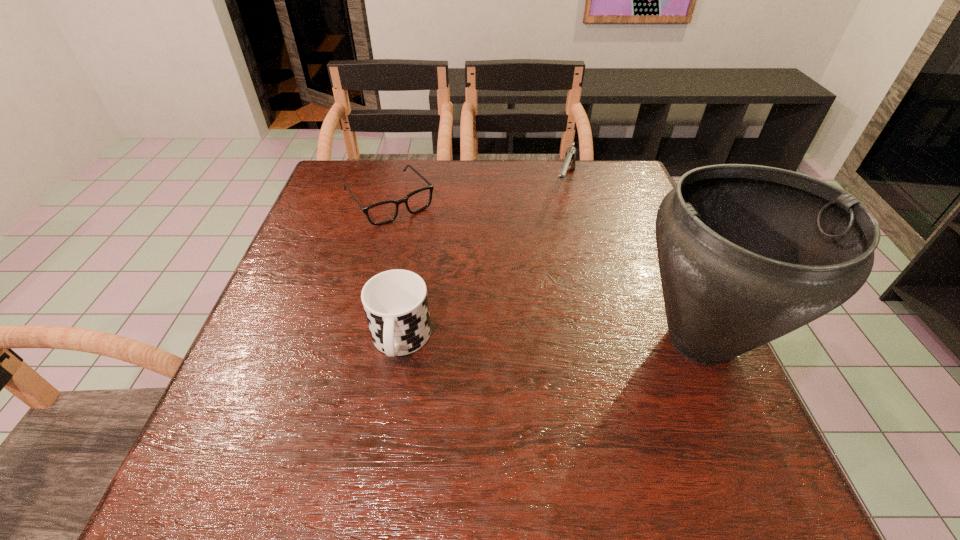
Locate an element on the screen. The image size is (960, 540). vacant space on the desktop that is between the cup and the tallest object and is positioned on the front-facing side of the shortest object is located at coordinates (510, 341).

Find the location of a particular element. Image resolution: width=960 pixels, height=540 pixels. vacant spot on the desktop that is between the cup and the urn and is positioned aiming along the barrel of the gun is located at coordinates (510, 341).